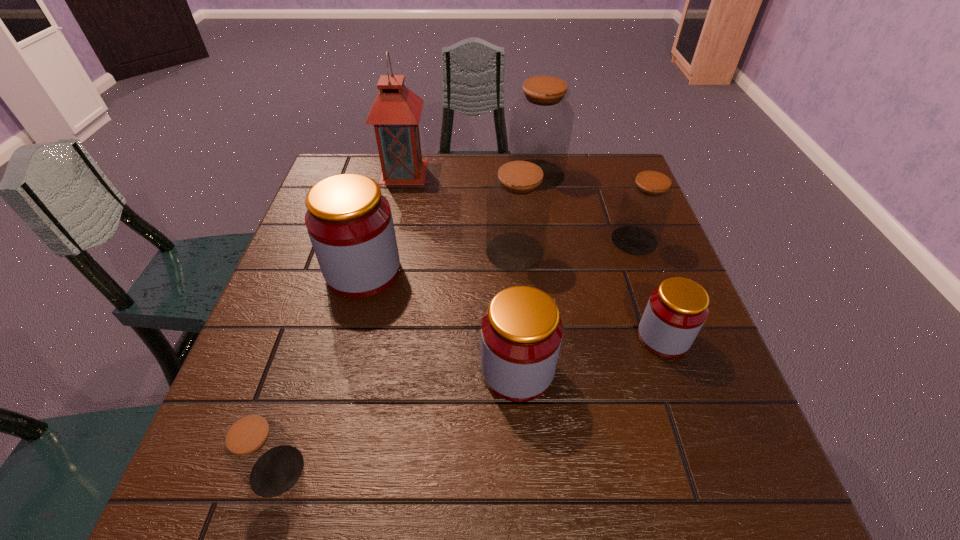
In order to click on vacant region that satisfies the following two spatial constraints: 1. on the front side of the lantern; 2. on the right side of the second tallest object in this screenshot , I will do `click(403, 174)`.

Where is `free space that satisfies the following two spatial constraints: 1. on the back side of the tallest jar; 2. on the right side of the second red jar from right to left`? free space that satisfies the following two spatial constraints: 1. on the back side of the tallest jar; 2. on the right side of the second red jar from right to left is located at coordinates (504, 174).